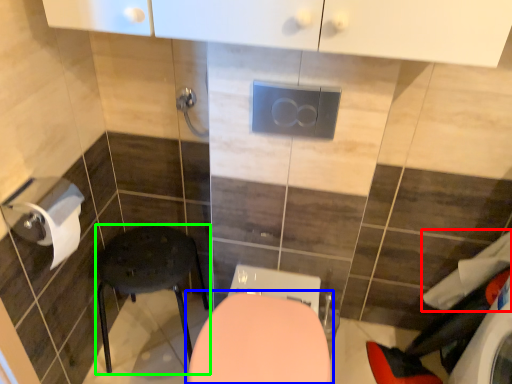
Question: Which object is the closest to the laundry (highlighted by a red box)? Choose among these: toilet (highlighted by a blue box) or furniture (highlighted by a green box).

Choices:
 (A) toilet
 (B) furniture

Answer: (A)